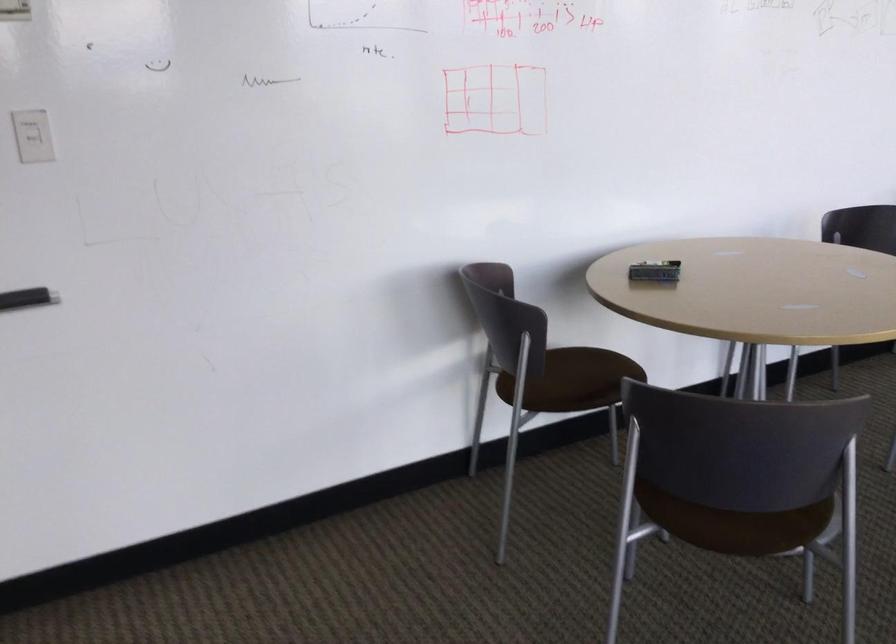
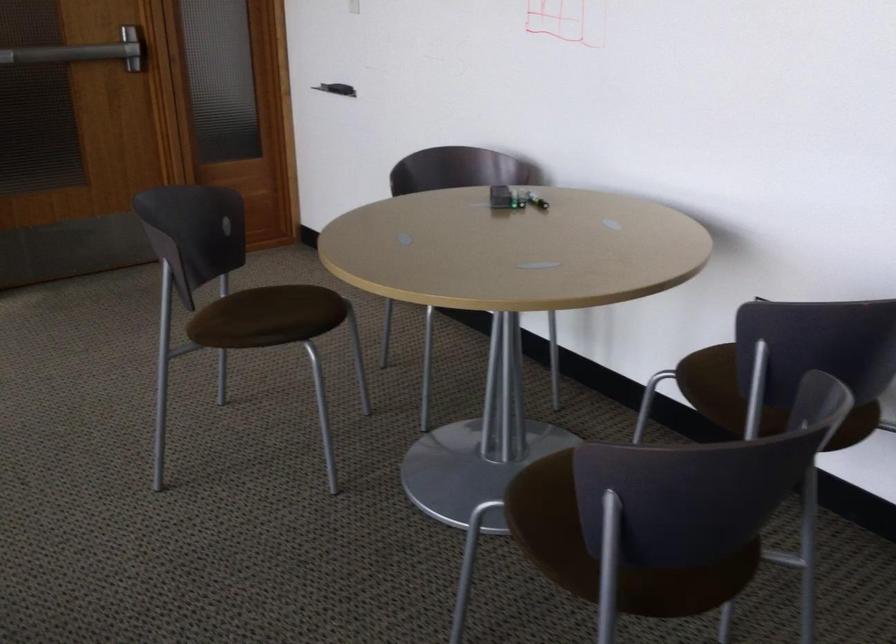
The point at (656, 270) is marked in the first image. Where is the corresponding point in the second image?

(515, 196)